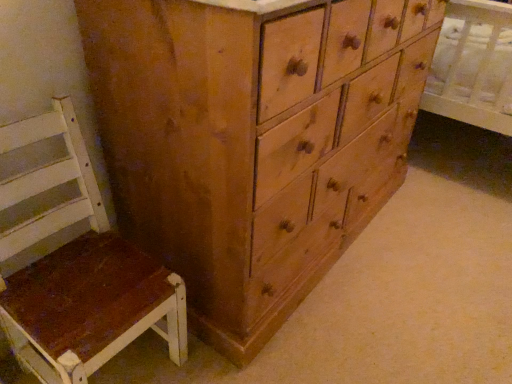
Question: Does white wood chair at left have a lesser height compared to wooden chest of drawers at center?

Choices:
 (A) yes
 (B) no

Answer: (B)

Question: From the image's perspective, is white wood chair at left located beneath wooden chest of drawers at center?

Choices:
 (A) yes
 (B) no

Answer: (A)

Question: Is white wood chair at left not inside wooden chest of drawers at center?

Choices:
 (A) yes
 (B) no

Answer: (A)

Question: Is white wood chair at left to the left of wooden chest of drawers at center from the viewer's perspective?

Choices:
 (A) yes
 (B) no

Answer: (A)

Question: Does white wood chair at left have a greater height compared to wooden chest of drawers at center?

Choices:
 (A) yes
 (B) no

Answer: (A)

Question: From a real-world perspective, is white wood chair at left physically above wooden chest of drawers at center?

Choices:
 (A) yes
 (B) no

Answer: (A)

Question: Is wooden chest of drawers at center further to camera compared to white wood chair at left?

Choices:
 (A) yes
 (B) no

Answer: (A)

Question: Is wooden chest of drawers at center positioned with its back to white wood chair at left?

Choices:
 (A) no
 (B) yes

Answer: (A)

Question: From the image's perspective, would you say wooden chest of drawers at center is positioned over white wood chair at left?

Choices:
 (A) no
 (B) yes

Answer: (B)

Question: Is wooden chest of drawers at center far away from white wood chair at left?

Choices:
 (A) yes
 (B) no

Answer: (B)

Question: From the image's perspective, is wooden chest of drawers at center under white wood chair at left?

Choices:
 (A) yes
 (B) no

Answer: (B)

Question: Does wooden chest of drawers at center have a larger size compared to white wood chair at left?

Choices:
 (A) no
 (B) yes

Answer: (A)

Question: From their relative heights in the image, would you say wooden chest of drawers at center is taller or shorter than white wood chair at left?

Choices:
 (A) tall
 (B) short

Answer: (B)